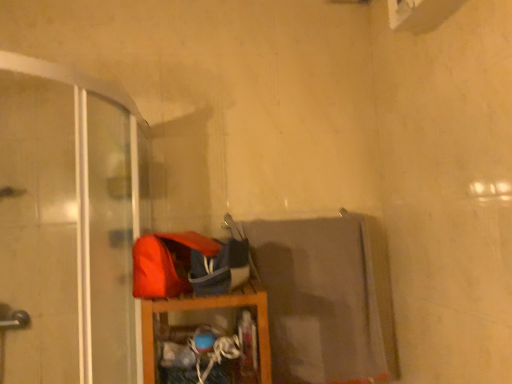
Question: Is transparent plastic screen door at left facing away from wooden shelf at lower center?

Choices:
 (A) no
 (B) yes

Answer: (A)

Question: Is transparent plastic screen door at left bigger than wooden shelf at lower center?

Choices:
 (A) yes
 (B) no

Answer: (A)

Question: Considering the relative sizes of transparent plastic screen door at left and wooden shelf at lower center in the image provided, is transparent plastic screen door at left smaller than wooden shelf at lower center?

Choices:
 (A) no
 (B) yes

Answer: (A)

Question: Would you say transparent plastic screen door at left is outside wooden shelf at lower center?

Choices:
 (A) no
 (B) yes

Answer: (B)

Question: Is transparent plastic screen door at left behind wooden shelf at lower center?

Choices:
 (A) no
 (B) yes

Answer: (A)

Question: Does transparent plastic screen door at left lie in front of wooden shelf at lower center?

Choices:
 (A) yes
 (B) no

Answer: (A)

Question: Can we say wooden shelf at lower center lies outside transparent plastic screen door at left?

Choices:
 (A) no
 (B) yes

Answer: (B)

Question: Is transparent plastic screen door at left at the back of wooden shelf at lower center?

Choices:
 (A) no
 (B) yes

Answer: (A)

Question: Can you confirm if wooden shelf at lower center is wider than transparent plastic screen door at left?

Choices:
 (A) no
 (B) yes

Answer: (A)

Question: From a real-world perspective, is wooden shelf at lower center located higher than transparent plastic screen door at left?

Choices:
 (A) no
 (B) yes

Answer: (A)

Question: Is transparent plastic screen door at left a part of wooden shelf at lower center?

Choices:
 (A) no
 (B) yes

Answer: (A)

Question: Is wooden shelf at lower center smaller than transparent plastic screen door at left?

Choices:
 (A) yes
 (B) no

Answer: (A)

Question: From a real-world perspective, relative to wooden shelf at lower center, is transparent plastic screen door at left vertically above or below?

Choices:
 (A) below
 (B) above

Answer: (B)